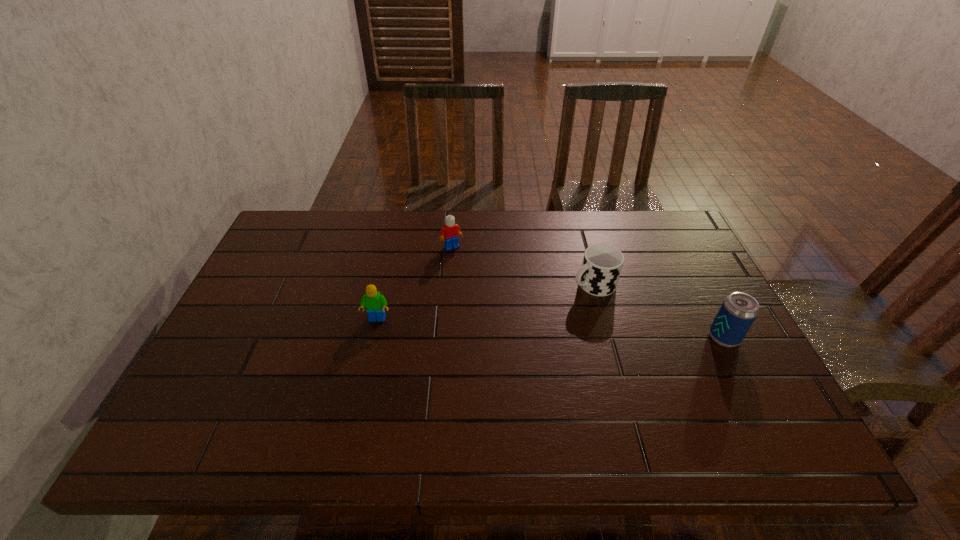
This screenshot has height=540, width=960. Identify the location of unoccupied position between the beer can and the nearer Lego. (550, 328).

Find the location of a particular element. The width and height of the screenshot is (960, 540). free space between the third nearest object and the nearest object is located at coordinates (659, 310).

Find the location of a particular element. unoccupied position between the left Lego and the right Lego is located at coordinates (415, 283).

The image size is (960, 540). In order to click on object that can be found as the third closest to the second nearest object in this screenshot , I will do `click(738, 311)`.

Identify which object is the second closest to the farther Lego. Please provide its 2D coordinates. Your answer should be formatted as a tuple, i.e. [(x, y)], where the tuple contains the x and y coordinates of a point satisfying the conditions above.

[(602, 263)]

The width and height of the screenshot is (960, 540). I want to click on vacant space that satisfies the following two spatial constraints: 1. on the front side of the second farthest object; 2. on the left side of the farther Lego, so click(448, 284).